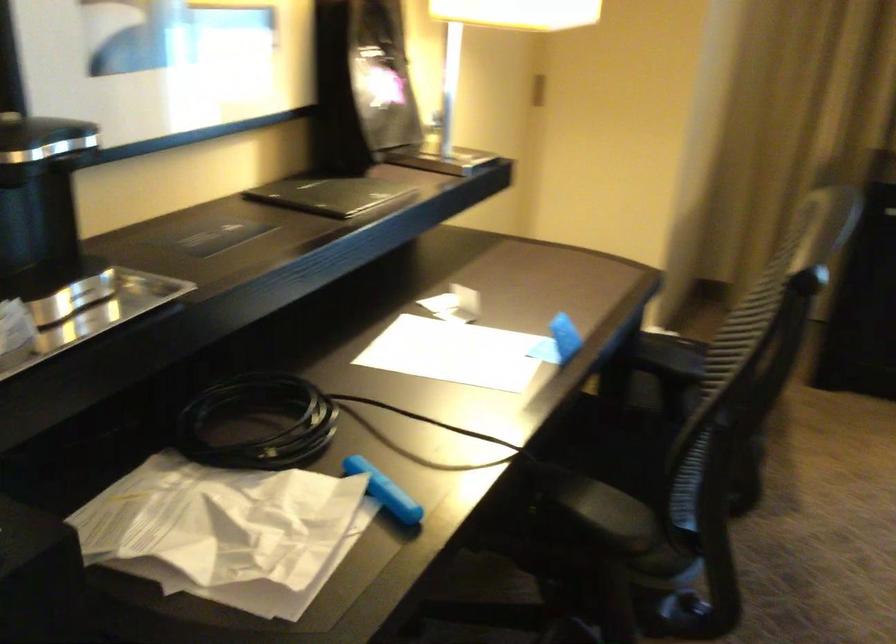
Image resolution: width=896 pixels, height=644 pixels. I want to click on chair sitting surface, so click(x=625, y=457).